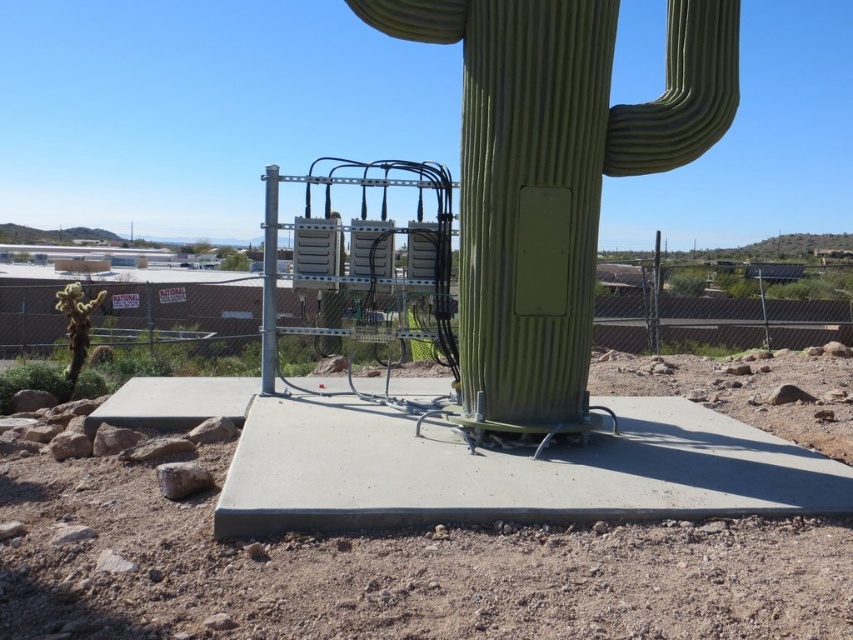
Is metallic gray pole at center above green matte cactus at lower left?

Indeed, metallic gray pole at center is positioned over green matte cactus at lower left.

Does metallic gray pole at center appear on the left side of green matte cactus at lower left?

No, metallic gray pole at center is not to the left of green matte cactus at lower left.

This screenshot has width=853, height=640. What do you see at coordinates (270, 280) in the screenshot? I see `metallic gray pole at center` at bounding box center [270, 280].

At what (x,y) coordinates should I click in order to perform the action: click on metallic gray pole at center. Please return your answer as a coordinate pair (x, y). This screenshot has width=853, height=640. Looking at the image, I should click on (270, 280).

Can you confirm if green matte cactus at center is shorter than green matte cactus at lower left?

No.

Is green matte cactus at center above green matte cactus at lower left?

Yes.

Describe the element at coordinates (553, 176) in the screenshot. The width and height of the screenshot is (853, 640). I see `green matte cactus at center` at that location.

Locate an element on the screen. green matte cactus at center is located at coordinates (553, 176).

Does green matte cactus at center have a greater height compared to metallic gray pole at center?

Yes, green matte cactus at center is taller than metallic gray pole at center.

Who is more distant from viewer, [556,262] or [276,236]?

Positioned behind is point [276,236].

At what (x,y) coordinates should I click in order to perform the action: click on green matte cactus at center. Please return your answer as a coordinate pair (x, y). The width and height of the screenshot is (853, 640). Looking at the image, I should click on (553, 176).